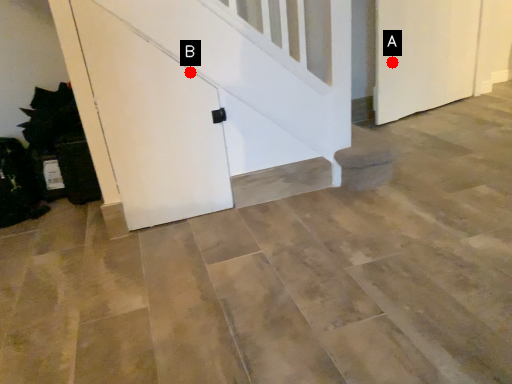
Question: Two points are circled on the image, labeled by A and B beside each circle. Which point appears closest to the camera in this image?

Choices:
 (A) A is closer
 (B) B is closer

Answer: (B)